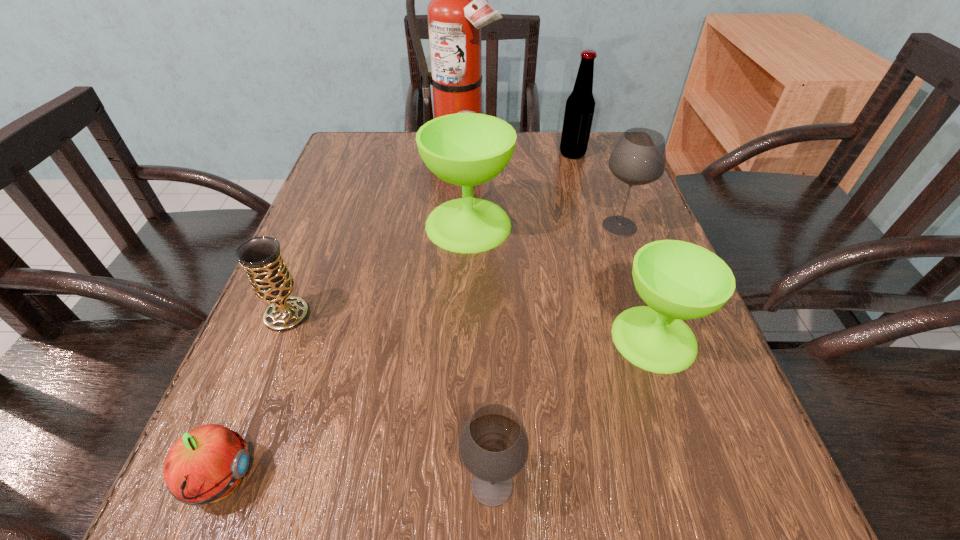
You are a GUI agent. You are given a task and a screenshot of the screen. Output one action in this format:
    pyautogui.click(x=<x>, y=<y>)
    Task: Click on the vacant area that lies between the bigger gray wineglass and the left green wineglass
    The width and height of the screenshot is (960, 540).
    Given the screenshot: What is the action you would take?
    pyautogui.click(x=544, y=226)

The image size is (960, 540). Identify the location of free space that is in between the right gray wineglass and the shortest object. (420, 354).

Where is `free point between the apple and the beer bottle`? Image resolution: width=960 pixels, height=540 pixels. free point between the apple and the beer bottle is located at coordinates (396, 317).

Identify which object is the sixth nearest to the farther green wineglass. Please provide its 2D coordinates. Your answer should be formatted as a tuple, i.e. [(x, y)], where the tuple contains the x and y coordinates of a point satisfying the conditions above.

[(494, 446)]

Identify the location of the third closest object relative to the chalice. (494, 446).

Identify which wineglass is located as the nearest to the farther green wineglass. Please provide its 2D coordinates. Your answer should be formatted as a tuple, i.e. [(x, y)], where the tuple contains the x and y coordinates of a point satisfying the conditions above.

[(639, 157)]

Identify which wineglass is the fourth closest to the shortest object. Please provide its 2D coordinates. Your answer should be formatted as a tuple, i.e. [(x, y)], where the tuple contains the x and y coordinates of a point satisfying the conditions above.

[(639, 157)]

Where is `vacant space that satisfies the following two spatial constraints: 1. on the back side of the second tallest object; 2. on the right side of the chalice`? This screenshot has width=960, height=540. vacant space that satisfies the following two spatial constraints: 1. on the back side of the second tallest object; 2. on the right side of the chalice is located at coordinates (352, 154).

Locate an element on the screen. This screenshot has width=960, height=540. vacant space that satisfies the following two spatial constraints: 1. from the nozzle of the nearer green wineglass; 2. on the right side of the tallest object is located at coordinates (445, 338).

You are a GUI agent. You are given a task and a screenshot of the screen. Output one action in this format:
    pyautogui.click(x=<x>, y=<y>)
    Task: Click on the blank area in the image that satisfies the following two spatial constraints: 1. on the back side of the left gray wineglass; 2. on the right side of the seventh shortest object
    This screenshot has height=540, width=960.
    Given the screenshot: What is the action you would take?
    pos(486,154)